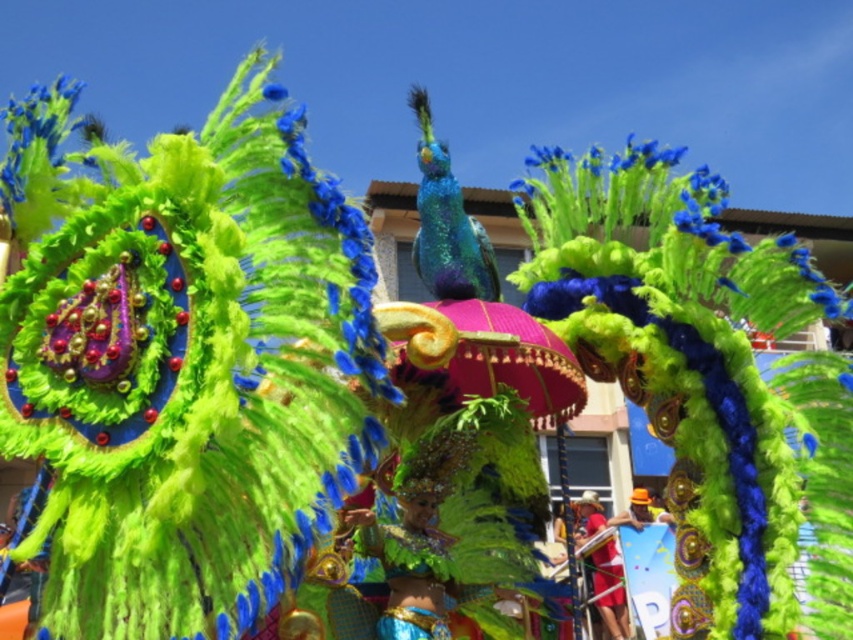
Question: Does shiny green costume at center have a greater width compared to red fabric at lower right?

Choices:
 (A) yes
 (B) no

Answer: (B)

Question: Does red fabric at lower right come in front of shiny metallic helmet at center?

Choices:
 (A) no
 (B) yes

Answer: (B)

Question: Which is nearer to the shiny metallic helmet at center?

Choices:
 (A) red fabric at lower right
 (B) pink satin umbrella at center

Answer: (A)

Question: Which of the following is the farthest from the observer?

Choices:
 (A) (381, 637)
 (B) (607, 579)
 (C) (611, 576)

Answer: (B)

Question: Based on their relative distances, which object is farther from the red fabric at lower right?

Choices:
 (A) shiny green costume at center
 (B) pink satin umbrella at center

Answer: (A)

Question: Does pink satin umbrella at center appear on the left side of red fabric at lower right?

Choices:
 (A) yes
 (B) no

Answer: (A)